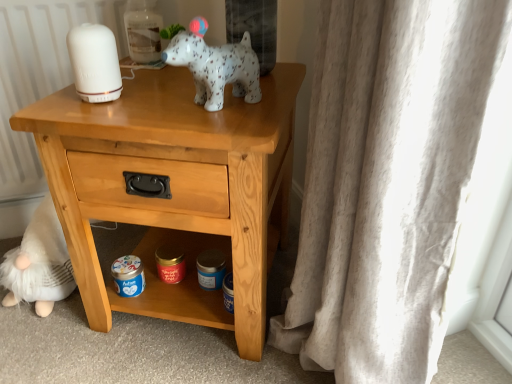
Question: Is white fluffy gnome at lower left outside of white speckled ceramic dog at upper center?

Choices:
 (A) no
 (B) yes

Answer: (B)

Question: Can you see white fluffy gnome at lower left touching white speckled ceramic dog at upper center?

Choices:
 (A) no
 (B) yes

Answer: (A)

Question: Can you confirm if white fluffy gnome at lower left is smaller than white speckled ceramic dog at upper center?

Choices:
 (A) no
 (B) yes

Answer: (A)

Question: Does white fluffy gnome at lower left turn towards white speckled ceramic dog at upper center?

Choices:
 (A) yes
 (B) no

Answer: (B)

Question: From the image's perspective, does white fluffy gnome at lower left appear lower than white speckled ceramic dog at upper center?

Choices:
 (A) yes
 (B) no

Answer: (A)

Question: Relative to white speckled ceramic dog at upper center, is white fluffy gnome at lower left in front or behind?

Choices:
 (A) front
 (B) behind

Answer: (B)

Question: From their relative heights in the image, would you say white fluffy gnome at lower left is taller or shorter than white speckled ceramic dog at upper center?

Choices:
 (A) short
 (B) tall

Answer: (B)

Question: In the image, is white fluffy gnome at lower left on the left side or the right side of white speckled ceramic dog at upper center?

Choices:
 (A) right
 (B) left

Answer: (B)

Question: From a real-world perspective, relative to white speckled ceramic dog at upper center, is white fluffy gnome at lower left vertically above or below?

Choices:
 (A) above
 (B) below

Answer: (B)

Question: Is light wood nightstand at center taller or shorter than white speckled ceramic dog at upper center?

Choices:
 (A) tall
 (B) short

Answer: (A)

Question: Considering the positions of light wood nightstand at center and white speckled ceramic dog at upper center in the image, is light wood nightstand at center bigger or smaller than white speckled ceramic dog at upper center?

Choices:
 (A) big
 (B) small

Answer: (A)

Question: Is light wood nightstand at center in front of or behind white speckled ceramic dog at upper center in the image?

Choices:
 (A) front
 (B) behind

Answer: (B)

Question: From the image's perspective, is light wood nightstand at center positioned above or below white speckled ceramic dog at upper center?

Choices:
 (A) above
 (B) below

Answer: (B)

Question: Considering the positions of white fluffy gnome at lower left and light wood nightstand at center in the image, is white fluffy gnome at lower left bigger or smaller than light wood nightstand at center?

Choices:
 (A) big
 (B) small

Answer: (B)

Question: Would you say white fluffy gnome at lower left is inside or outside light wood nightstand at center?

Choices:
 (A) outside
 (B) inside

Answer: (A)